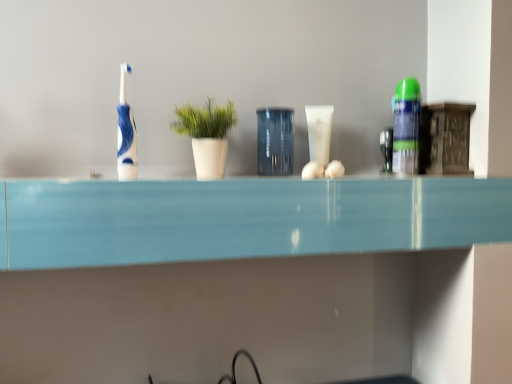
Question: Does transparent glass jar at center appear on the right side of green matte plant at center?

Choices:
 (A) yes
 (B) no

Answer: (A)

Question: From the image's perspective, is transparent glass jar at center below green matte plant at center?

Choices:
 (A) no
 (B) yes

Answer: (A)

Question: Considering the relative sizes of transparent glass jar at center and green matte plant at center in the image provided, is transparent glass jar at center thinner than green matte plant at center?

Choices:
 (A) no
 (B) yes

Answer: (B)

Question: Considering the relative sizes of transparent glass jar at center and green matte plant at center in the image provided, is transparent glass jar at center smaller than green matte plant at center?

Choices:
 (A) no
 (B) yes

Answer: (B)

Question: From a real-world perspective, does transparent glass jar at center sit lower than green matte plant at center?

Choices:
 (A) yes
 (B) no

Answer: (A)

Question: Is transparent glass jar at center taller than green matte plant at center?

Choices:
 (A) no
 (B) yes

Answer: (B)

Question: Is blue glossy toothbrush at left facing away from green matte shaving cream can at right, the first toiletry in the right-to-left sequence?

Choices:
 (A) no
 (B) yes

Answer: (A)

Question: Considering the relative sizes of blue glossy toothbrush at left and green matte shaving cream can at right, acting as the 2th toiletry starting from the left, in the image provided, is blue glossy toothbrush at left bigger than green matte shaving cream can at right, acting as the 2th toiletry starting from the left,?

Choices:
 (A) yes
 (B) no

Answer: (B)

Question: Is green matte shaving cream can at right, the first toiletry in the right-to-left sequence, surrounded by blue glossy toothbrush at left?

Choices:
 (A) yes
 (B) no

Answer: (B)

Question: Does blue glossy toothbrush at left have a lesser width compared to green matte shaving cream can at right, the first toiletry in the right-to-left sequence?

Choices:
 (A) yes
 (B) no

Answer: (A)

Question: Is blue glossy toothbrush at left touching green matte shaving cream can at right, the first toiletry in the right-to-left sequence?

Choices:
 (A) no
 (B) yes

Answer: (A)

Question: Does blue glossy toothbrush at left have a greater width compared to green matte shaving cream can at right, the first toiletry in the right-to-left sequence?

Choices:
 (A) yes
 (B) no

Answer: (B)

Question: Is green matte plant at center behind transparent glass jar at center?

Choices:
 (A) no
 (B) yes

Answer: (A)